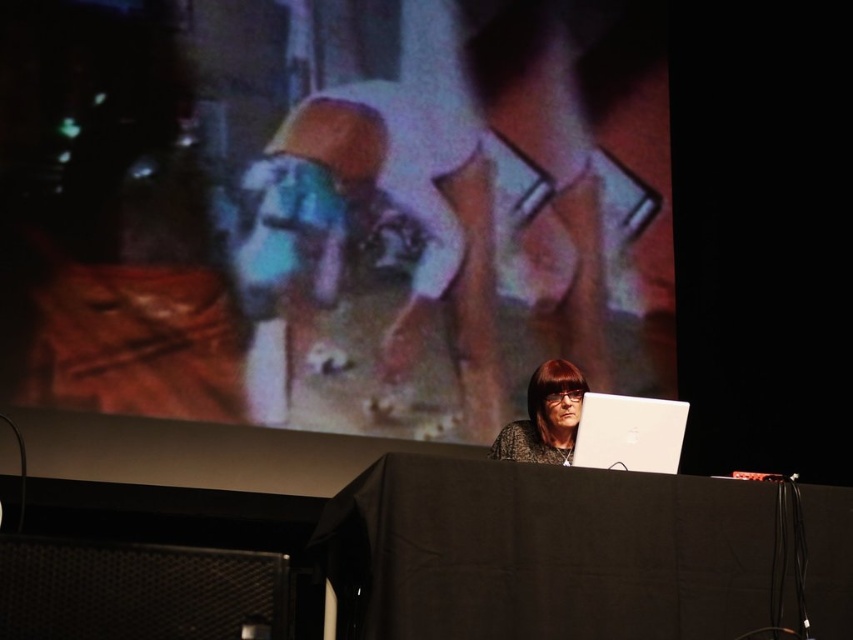
Is silver metallic laptop at center positioned before matte black hair at center?

Yes, silver metallic laptop at center is closer to the viewer.

Is point (631, 433) positioned behind point (548, 410)?

No, (631, 433) is closer to viewer.

Which is behind, point (608, 396) or point (508, 442)?

Point (508, 442)

Locate an element on the screen. This screenshot has width=853, height=640. silver metallic laptop at center is located at coordinates (630, 433).

From the picture: Which is more to the left, black mesh speaker at lower left or matte black hair at center?

Result: From the viewer's perspective, black mesh speaker at lower left appears more on the left side.

Can you confirm if black mesh speaker at lower left is wider than matte black hair at center?

Correct, the width of black mesh speaker at lower left exceeds that of matte black hair at center.

At what (x,y) coordinates should I click in order to perform the action: click on black mesh speaker at lower left. Please return your answer as a coordinate pair (x, y). Looking at the image, I should click on (138, 592).

Locate an element on the screen. The height and width of the screenshot is (640, 853). black mesh speaker at lower left is located at coordinates (138, 592).

How much distance is there between black matte table at center and silver metallic laptop at center?

A distance of 32.69 centimeters exists between black matte table at center and silver metallic laptop at center.

Locate an element on the screen. black matte table at center is located at coordinates (544, 552).

Locate an element on the screen. Image resolution: width=853 pixels, height=640 pixels. black matte table at center is located at coordinates (544, 552).